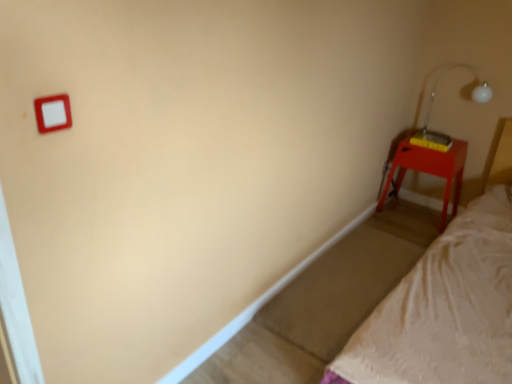
Question: Looking at the image, does matte red nightstand at right seem bigger or smaller compared to transparent plastic lamp at upper right?

Choices:
 (A) small
 (B) big

Answer: (B)

Question: From a real-world perspective, relative to transparent plastic lamp at upper right, is matte red nightstand at right vertically above or below?

Choices:
 (A) below
 (B) above

Answer: (A)

Question: Considering the positions of matte red nightstand at right and transparent plastic lamp at upper right in the image, is matte red nightstand at right taller or shorter than transparent plastic lamp at upper right?

Choices:
 (A) short
 (B) tall

Answer: (B)

Question: Is transparent plastic lamp at upper right in front of or behind matte red nightstand at right in the image?

Choices:
 (A) front
 (B) behind

Answer: (A)

Question: In terms of size, does transparent plastic lamp at upper right appear bigger or smaller than matte red nightstand at right?

Choices:
 (A) small
 (B) big

Answer: (A)

Question: From the image's perspective, is transparent plastic lamp at upper right above or below matte red nightstand at right?

Choices:
 (A) above
 (B) below

Answer: (A)

Question: Is transparent plastic lamp at upper right inside the boundaries of matte red nightstand at right, or outside?

Choices:
 (A) outside
 (B) inside

Answer: (A)